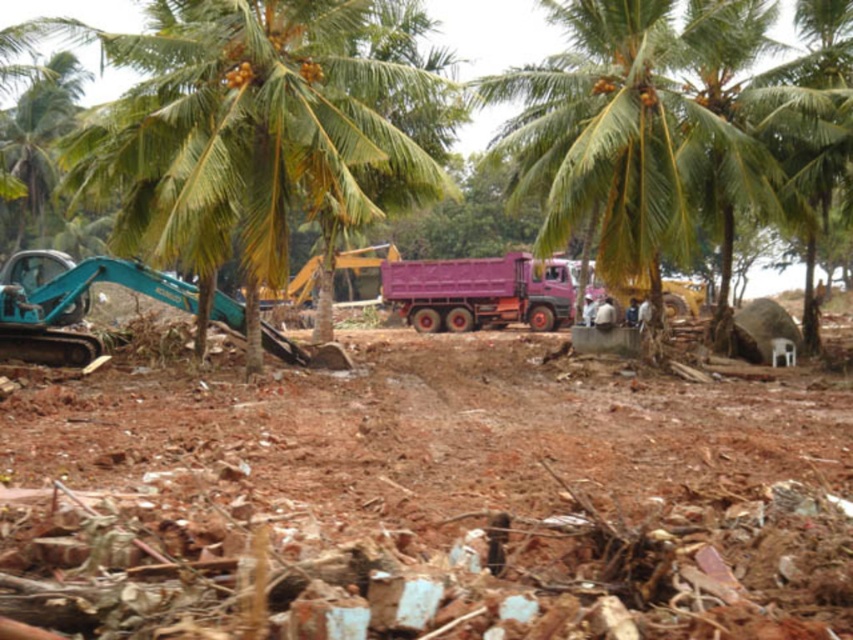
You are a construction worker trying to move a heavy object from the debris pile to the dump truck. Which object, the teal metallic excavator at left or the pink matte truck at center, is closer to you if you are standing near the debris pile?

The pink matte truck at center is closer to you because the teal metallic excavator at left is behind it, making the truck the nearer option.

You are standing at point (260, 88) and want to walk to the pink dump truck with red wheels. The distance between you and the truck is 17.16 meters. If you can walk at 1.5 meters per second, how long will it take you to reach the truck?

The distance between you and the pink dump truck with red wheels is 17.16 meters. At a walking speed of 1.5 meters per second, it will take approximately 11.44 seconds to reach the truck.